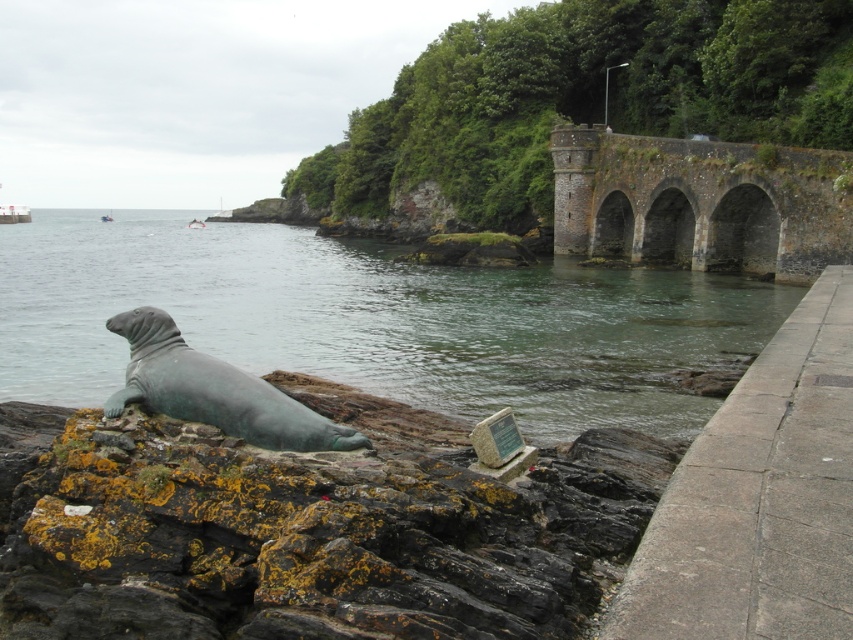
Question: Does greenish water at lower left have a greater width compared to green patina statue at lower left?

Choices:
 (A) no
 (B) yes

Answer: (B)

Question: Can you confirm if greenish water at lower left is positioned below brown stone bridge at upper right?

Choices:
 (A) no
 (B) yes

Answer: (A)

Question: Which is farther from the greenish water at lower left?

Choices:
 (A) green patina statue at lower left
 (B) brown stone bridge at upper right

Answer: (A)

Question: Does greenish water at lower left have a greater width compared to brown stone bridge at upper right?

Choices:
 (A) yes
 (B) no

Answer: (A)

Question: Which object is the farthest from the green patina statue at lower left?

Choices:
 (A) brown stone bridge at upper right
 (B) greenish water at lower left

Answer: (A)

Question: Estimate the real-world distances between objects in this image. Which object is closer to the brown stone bridge at upper right?

Choices:
 (A) greenish water at lower left
 (B) green patina statue at lower left

Answer: (A)